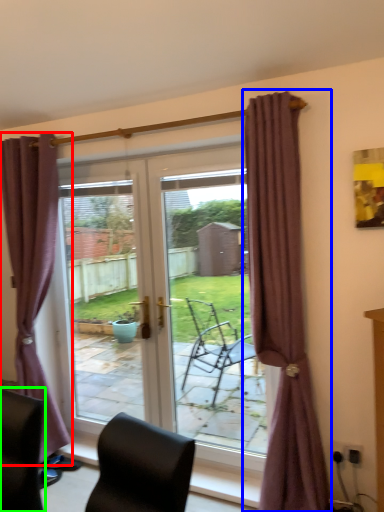
Question: Which object is the farthest from curtain (highlighted by a red box)? Choose among these: curtain (highlighted by a blue box) or chair (highlighted by a green box).

Choices:
 (A) curtain
 (B) chair

Answer: (A)